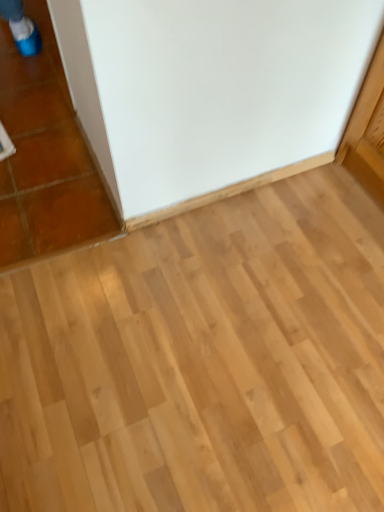
The height and width of the screenshot is (512, 384). What do you see at coordinates (203, 361) in the screenshot?
I see `natural wood floor at center` at bounding box center [203, 361].

You are a GUI agent. You are given a task and a screenshot of the screen. Output one action in this format:
    pyautogui.click(x=<x>, y=<y>)
    Task: Click on the natural wood floor at center
    
    Given the screenshot: What is the action you would take?
    pyautogui.click(x=203, y=361)

You are a GUI agent. You are given a task and a screenshot of the screen. Output one action in this format:
    pyautogui.click(x=<x>, y=<y>)
    Task: Click on the natural wood floor at center
    This screenshot has width=384, height=512.
    Given the screenshot: What is the action you would take?
    pyautogui.click(x=203, y=361)